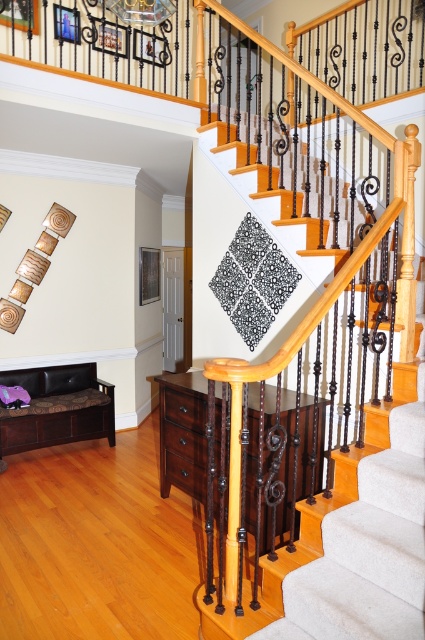
Which is in front, point (257, 372) or point (48, 380)?

Point (257, 372)

Can you confirm if white carpeted stairs at upper center is positioned to the right of brown leather bench at lower left?

Indeed, white carpeted stairs at upper center is positioned on the right side of brown leather bench at lower left.

Between point (266, 605) and point (0, 417), which one is positioned in front?

Point (266, 605) is in front.

Find the location of `white carpeted stairs at upper center`. white carpeted stairs at upper center is located at coordinates (334, 451).